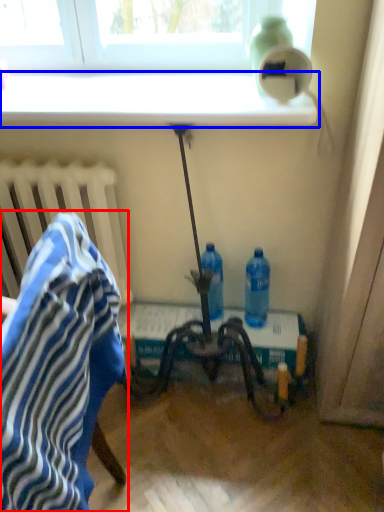
Question: Which of the following is the closest to the observer, chair (highlighted by a red box) or window sill (highlighted by a blue box)?

Choices:
 (A) chair
 (B) window sill

Answer: (A)